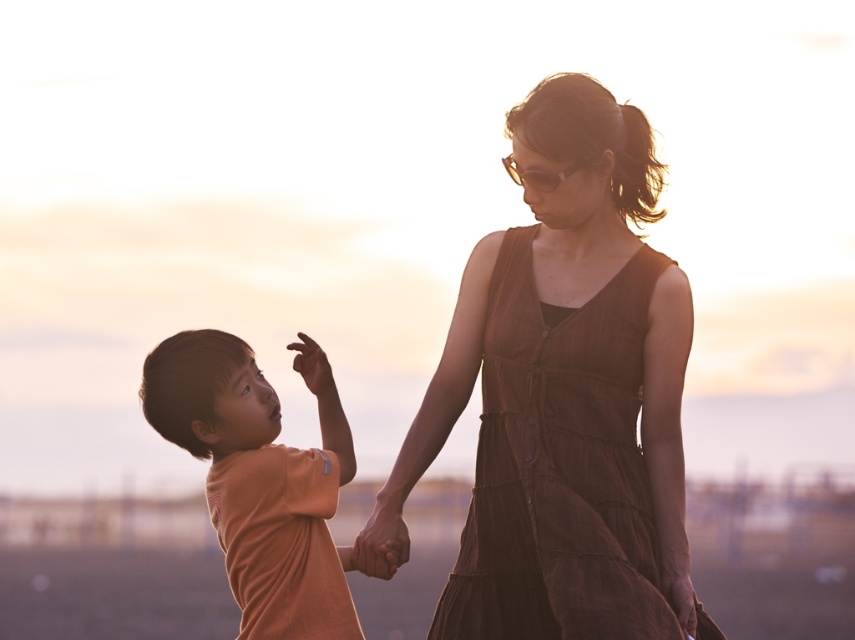
Question: Among these objects, which one is farthest from the camera?

Choices:
 (A) orange cotton shirt at left
 (B) gold reflective sunglasses at upper center
 (C) brown textured dress at center

Answer: (B)

Question: Can you confirm if brown textured dress at center is positioned to the right of orange cotton shirt at left?

Choices:
 (A) no
 (B) yes

Answer: (B)

Question: Which object is positioned closest to the gold reflective sunglasses at upper center?

Choices:
 (A) orange cotton shirt at left
 (B) brown textured dress at center

Answer: (B)

Question: Does orange cotton shirt at left appear under gold reflective sunglasses at upper center?

Choices:
 (A) no
 (B) yes

Answer: (B)

Question: Is orange cotton shirt at left behind gold reflective sunglasses at upper center?

Choices:
 (A) no
 (B) yes

Answer: (A)

Question: Which object appears closest to the camera in this image?

Choices:
 (A) brown textured dress at center
 (B) gold reflective sunglasses at upper center
 (C) orange cotton shirt at left

Answer: (C)